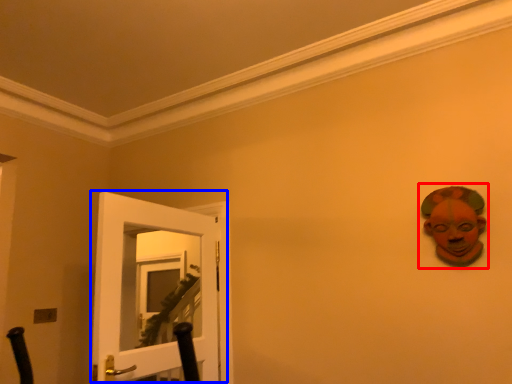
Question: Among these objects, which one is farthest to the camera, person (highlighted by a red box) or door (highlighted by a blue box)?

Choices:
 (A) person
 (B) door

Answer: (A)